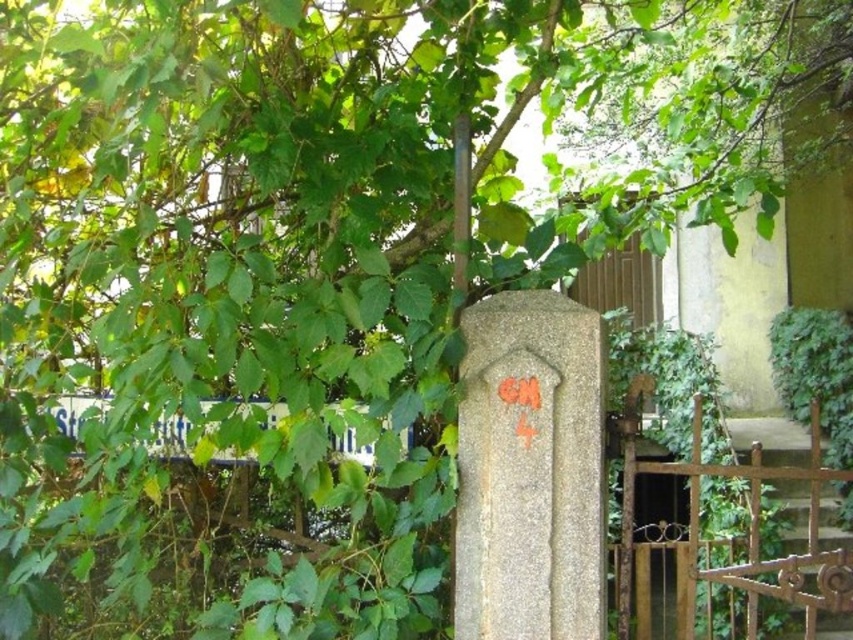
You are a delivery person trying to navigate through a garden path. You see the granite gravestone at center and the white plastic street sign at lower left. Which object is nearer to you as you approach the garden entrance?

The granite gravestone at center is closer to the viewer than the white plastic street sign at lower left, so the gravestone is nearer to you as you approach the garden entrance.

You are standing in a garden with a granite gravestone at center. You want to place a bouquet of flowers at the base of the gravestone. If your arm reaches 1.8 meters, can you reach the base without moving closer?

The granite gravestone at center is 2.03 meters away from you. Since your arm reaches 1.8 meters, you cannot reach the base without moving closer.

You are a landscape architect designing a new garden layout. You have to place the granite gravestone at center and the white plastic street sign at lower left in the garden. Which object should you prioritize placing first if you want to ensure there is enough space for both?

The granite gravestone at center should be prioritized since it occupies less space than the white plastic street sign at lower left, allowing more flexibility in arranging the larger street sign afterward.